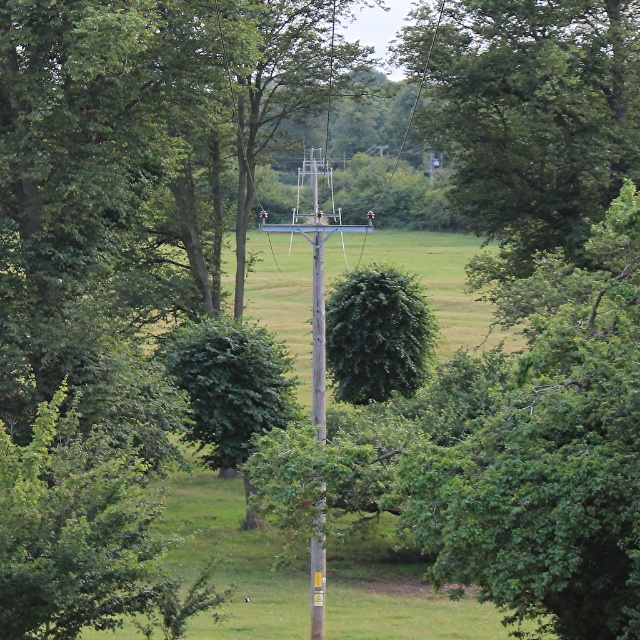
Question: Among these objects, which one is farthest from the camera?

Choices:
 (A) green leafy tree at center
 (B) wooden telegraph pole at center

Answer: (A)

Question: Does green leafy tree at center have a greater width compared to wooden telegraph pole at center?

Choices:
 (A) no
 (B) yes

Answer: (B)

Question: Which of the following is the farthest from the observer?

Choices:
 (A) (520, 120)
 (B) (321, 442)

Answer: (A)

Question: Does green leafy tree at center appear over wooden telegraph pole at center?

Choices:
 (A) no
 (B) yes

Answer: (B)

Question: Is green leafy tree at center thinner than wooden telegraph pole at center?

Choices:
 (A) yes
 (B) no

Answer: (B)